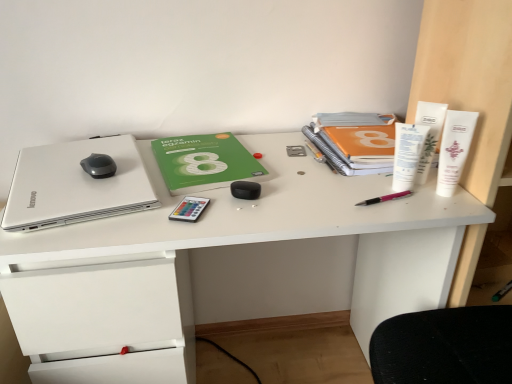
Where is `free space that is in between orange matte notebook at upper right, which is the 2th paperback book in left-to-right order, and green matte paperback book at center, which appears as the 1th paperback book when viewed from the left`? free space that is in between orange matte notebook at upper right, which is the 2th paperback book in left-to-right order, and green matte paperback book at center, which appears as the 1th paperback book when viewed from the left is located at coordinates (280, 156).